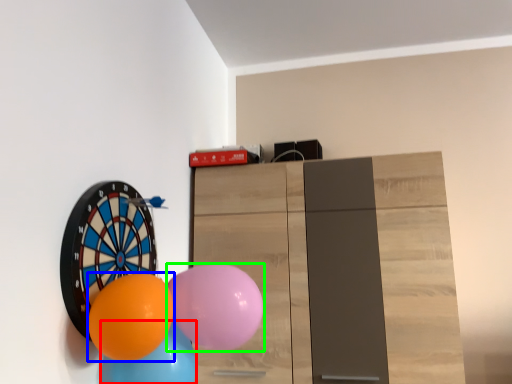
Question: Estimate the real-world distances between objects in this image. Which object is farther from balloon (highlighted by a red box), balloon (highlighted by a blue box) or balloon (highlighted by a green box)?

Choices:
 (A) balloon
 (B) balloon

Answer: (B)